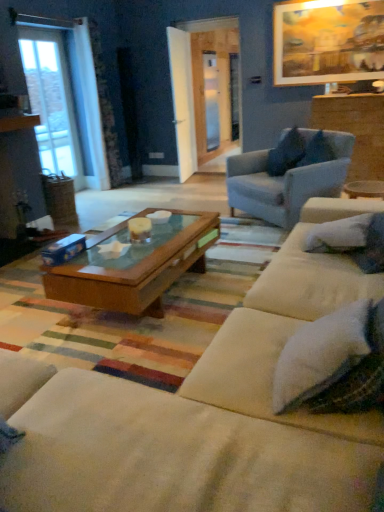
Question: From their relative heights in the image, would you say white fabric couch at center is taller or shorter than fluffy white pillow at right, positioned as the 2th pillow in bottom-to-top order?

Choices:
 (A) short
 (B) tall

Answer: (B)

Question: From the image's perspective, is white fabric couch at center located above or below fluffy white pillow at right, placed as the 1th pillow when sorted from front to back?

Choices:
 (A) below
 (B) above

Answer: (A)

Question: Estimate the real-world distances between objects in this image. Which object is closer to the white fabric couch at center?

Choices:
 (A) fluffy white pillow at right, the third pillow viewed from the back
 (B) clear glass screen door at center, the second screen door from the right
 (C) wooden picture frame at upper right
 (D) light blue fabric armchair at upper right
 (E) blue fabric pillow at upper right, which appears as the 1th pillow when viewed from the top

Answer: (A)

Question: Estimate the real-world distances between objects in this image. Which object is farther from the blue fabric pillow at upper right, the 1th pillow from the back?

Choices:
 (A) clear glass screen door at center, the second screen door from the right
 (B) clear glass door at left
 (C) clear glass screen door at center, the first screen door positioned from the right
 (D) wooden picture frame at upper right
 (E) white fabric couch at center

Answer: (B)